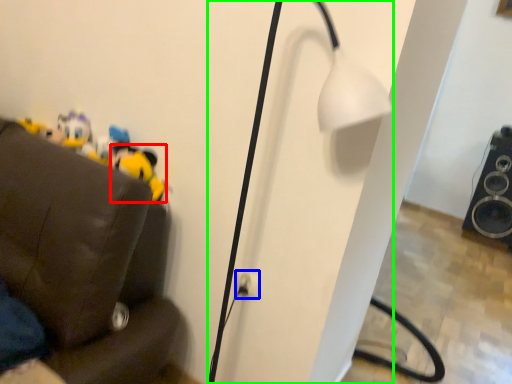
Question: Estimate the real-world distances between objects in this image. Which object is farther from toy (highlighted by a red box), electric outlet (highlighted by a blue box) or lamp (highlighted by a green box)?

Choices:
 (A) electric outlet
 (B) lamp

Answer: (B)